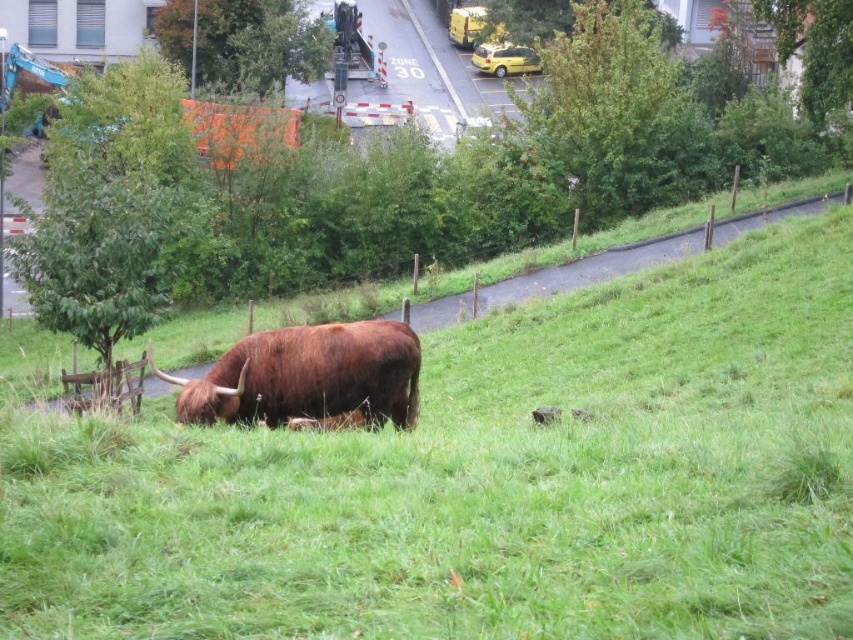
From the picture: You are a farmer who needs to move a fence post from the green grassy at center to the brown furry bull at center. What is the minimum distance you need to travel?

The minimum distance you need to travel between the green grassy at center and the brown furry bull at center is 3.65 meters.

You are standing at the point labeled as point (488, 481) in the image. What is the immediate terrain you are standing on?

The point (488, 481) corresponds to green grassy at center, so you are standing on green grassy terrain.